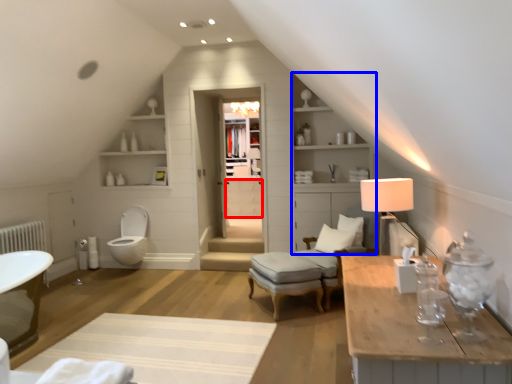
Question: Which object appears farthest to the camera in this image, drawer (highlighted by a red box) or dresser (highlighted by a blue box)?

Choices:
 (A) drawer
 (B) dresser

Answer: (A)